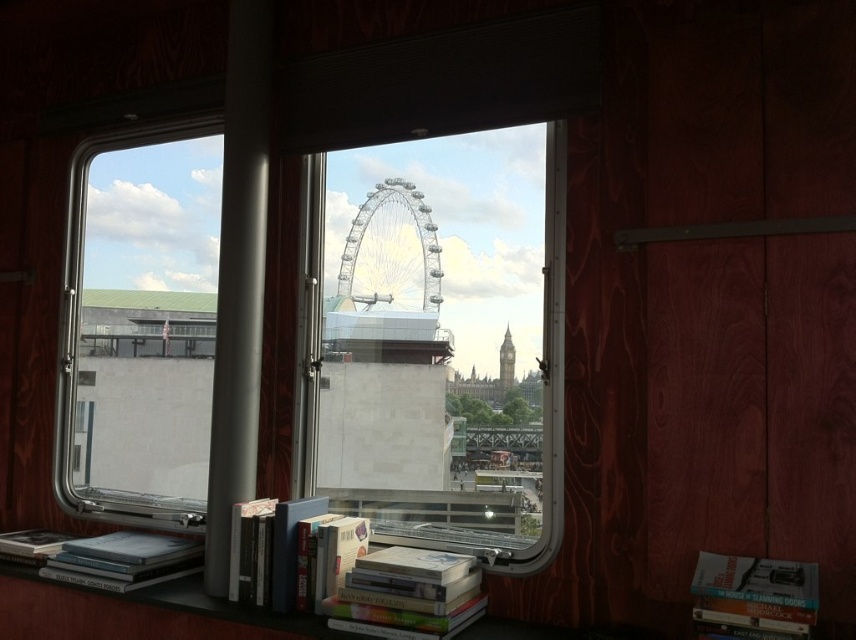
Question: Can you confirm if clear glass window at center is wider than white metallic ferris wheel at center?

Choices:
 (A) no
 (B) yes

Answer: (B)

Question: Can you confirm if white metallic ferris wheel at center is positioned to the right of hardcover book at lower right?

Choices:
 (A) yes
 (B) no

Answer: (B)

Question: Estimate the real-world distances between objects in this image. Which object is farther from the hardcover book at center?

Choices:
 (A) clear glass window at center
 (B) clear glass window at upper left
 (C) white metallic ferris wheel at center
 (D) hardcover book at lower right

Answer: (B)

Question: Which point appears farthest from the camera in this image?

Choices:
 (A) (294, 529)
 (B) (747, 624)
 (C) (401, 272)

Answer: (C)

Question: Which point is closer to the camera?

Choices:
 (A) (399, 275)
 (B) (812, 605)

Answer: (B)

Question: Can you confirm if clear glass window at center is wider than hardcover book at center?

Choices:
 (A) no
 (B) yes

Answer: (B)